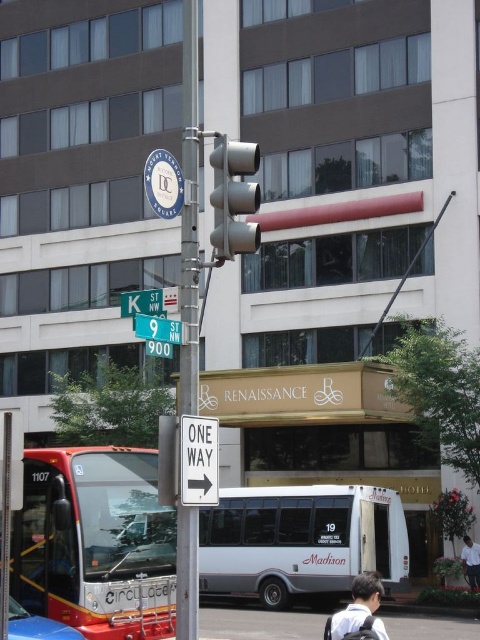
Question: Does green metallic street sign at upper left appear under white cotton shirt at lower right?

Choices:
 (A) yes
 (B) no

Answer: (B)

Question: Is red metallic bus at lower left further to the viewer compared to green matte street sign at center?

Choices:
 (A) yes
 (B) no

Answer: (A)

Question: Which object is closer to the camera taking this photo?

Choices:
 (A) white cotton shirt at lower right
 (B) green matte street sign at center
 (C) red metallic bus at lower left

Answer: (B)

Question: Does white metallic bus at center lie in front of green metallic street sign at upper left?

Choices:
 (A) no
 (B) yes

Answer: (A)

Question: Which point appears closest to the camera in this image?

Choices:
 (A) (362, 598)
 (B) (148, 317)
 (C) (254, 172)

Answer: (A)

Question: Among these points, which one is nearest to the camera?

Choices:
 (A) (168, 308)
 (B) (252, 492)
 (C) (163, 333)

Answer: (A)